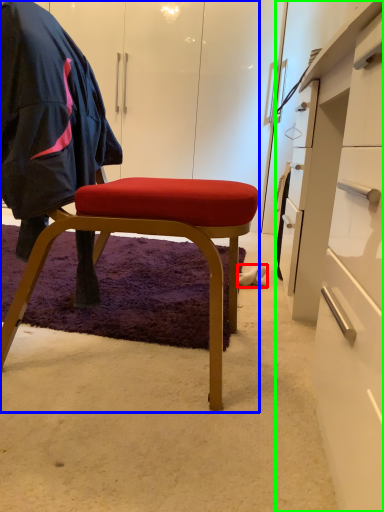
Question: Estimate the real-world distances between objects in this image. Which object is closer to footwear (highlighted by a red box), chair (highlighted by a blue box) or desk (highlighted by a green box)?

Choices:
 (A) chair
 (B) desk

Answer: (B)